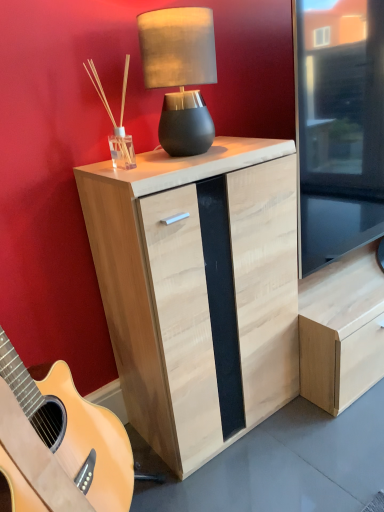
At what (x,y) coordinates should I click in order to perform the action: click on free space in front of matte black lamp at upper center. Please return your answer as a coordinate pair (x, y). Looking at the image, I should click on (180, 161).